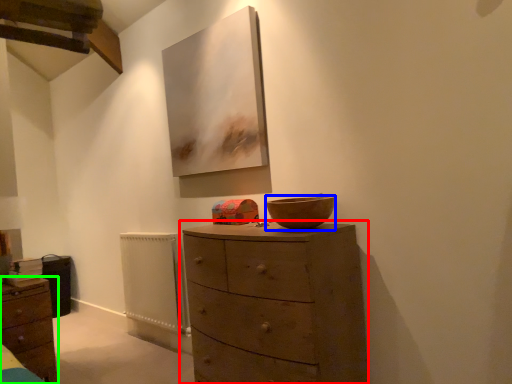
Question: Considering the real-world distances, which object is closest to chest of drawers (highlighted by a red box)? bowl (highlighted by a blue box) or chest of drawers (highlighted by a green box).

Choices:
 (A) bowl
 (B) chest of drawers

Answer: (A)